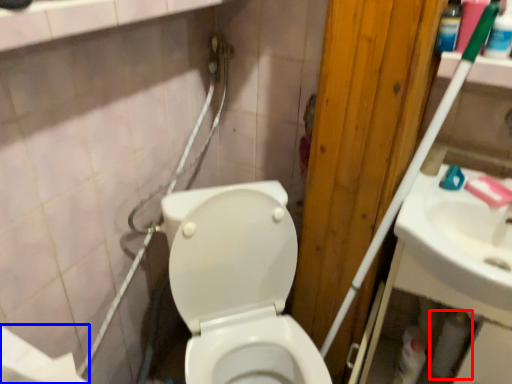
Question: Which object appears closest to the camera in this image, toilet paper (highlighted by a red box) or toilet paper (highlighted by a blue box)?

Choices:
 (A) toilet paper
 (B) toilet paper

Answer: (B)